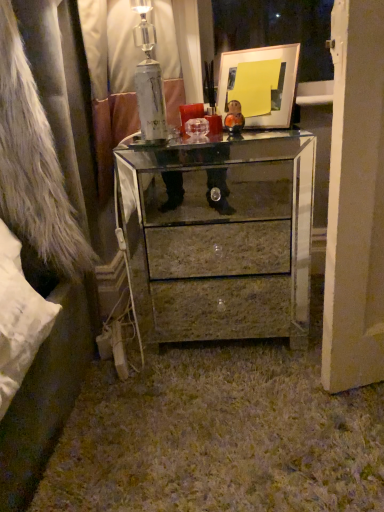
Question: In the image, is mirrored glass chest of drawers at center positioned in front of or behind matte gold picture frame at upper center?

Choices:
 (A) behind
 (B) front

Answer: (B)

Question: Considering the positions of mirrored glass chest of drawers at center and matte gold picture frame at upper center in the image, is mirrored glass chest of drawers at center bigger or smaller than matte gold picture frame at upper center?

Choices:
 (A) big
 (B) small

Answer: (A)

Question: Estimate the real-world distances between objects in this image. Which object is farther from the mirrored glass chest of drawers at center?

Choices:
 (A) matte gold picture frame at upper center
 (B) brown marble drawer at center

Answer: (A)

Question: Estimate the real-world distances between objects in this image. Which object is closer to the brown marble drawer at center?

Choices:
 (A) mirrored glass chest of drawers at center
 (B) matte gold picture frame at upper center

Answer: (A)